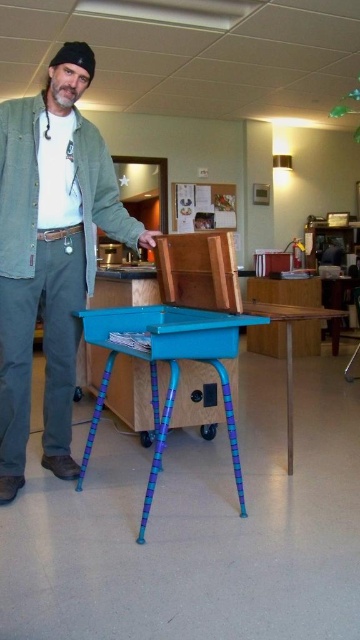
Question: Which point appears farthest from the camera in this image?

Choices:
 (A) (81, 280)
 (B) (311, 308)
 (C) (145, 333)
 (D) (354, 352)

Answer: (D)

Question: Can you confirm if wooden table at center is thinner than metallic silver folding chair at right?

Choices:
 (A) no
 (B) yes

Answer: (B)

Question: Does teal plastic table at center appear under wooden table at center?

Choices:
 (A) yes
 (B) no

Answer: (A)

Question: Is matte green jacket at center below wooden table at center?

Choices:
 (A) yes
 (B) no

Answer: (B)

Question: Estimate the real-world distances between objects in this image. Which object is farther from the metallic silver folding chair at right?

Choices:
 (A) wooden table at center
 (B) matte green jacket at center

Answer: (B)

Question: Which point is closer to the camera?

Choices:
 (A) (18, 172)
 (B) (348, 362)
 (C) (333, 330)

Answer: (A)